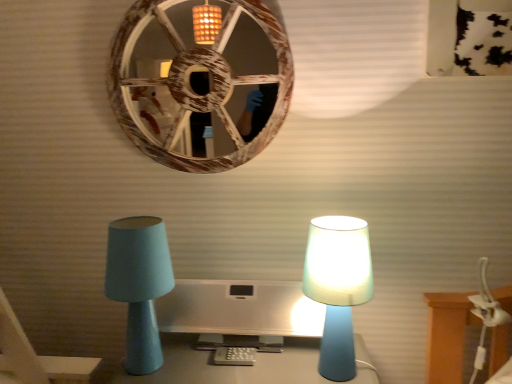
Question: Can we say wooden wheel at upper center lies outside matte blue lamp at left, the first lamp from the left?

Choices:
 (A) no
 (B) yes

Answer: (B)

Question: Can you confirm if wooden wheel at upper center is smaller than matte blue lamp at left, the first lamp from the left?

Choices:
 (A) yes
 (B) no

Answer: (B)

Question: Is wooden wheel at upper center to the right of matte blue lamp at left, the first lamp from the left, from the viewer's perspective?

Choices:
 (A) no
 (B) yes

Answer: (B)

Question: Is wooden wheel at upper center positioned with its back to matte blue lamp at left, which is counted as the second lamp, starting from the right?

Choices:
 (A) yes
 (B) no

Answer: (B)

Question: Is wooden wheel at upper center in contact with matte blue lamp at left, which is counted as the second lamp, starting from the right?

Choices:
 (A) no
 (B) yes

Answer: (A)

Question: From a real-world perspective, is satin silver monitor at center physically located above or below matte blue lamp at left, which is counted as the second lamp, starting from the right?

Choices:
 (A) above
 (B) below

Answer: (B)

Question: Relative to matte blue lamp at left, the first lamp from the left, is satin silver monitor at center in front or behind?

Choices:
 (A) front
 (B) behind

Answer: (B)

Question: Looking at their shapes, would you say satin silver monitor at center is wider or thinner than matte blue lamp at left, which is counted as the second lamp, starting from the right?

Choices:
 (A) wide
 (B) thin

Answer: (A)

Question: In terms of height, does satin silver monitor at center look taller or shorter compared to matte blue lamp at left, the first lamp from the left?

Choices:
 (A) tall
 (B) short

Answer: (B)

Question: From a real-world perspective, is matte blue lamp at left, the first lamp from the left, positioned above or below wooden wheel at upper center?

Choices:
 (A) above
 (B) below

Answer: (B)

Question: Does point (157, 225) appear closer or farther from the camera than point (196, 152)?

Choices:
 (A) farther
 (B) closer

Answer: (B)

Question: Is matte blue lamp at left, which is counted as the second lamp, starting from the right, wider or thinner than wooden wheel at upper center?

Choices:
 (A) wide
 (B) thin

Answer: (A)

Question: Visually, is matte blue lamp at left, which is counted as the second lamp, starting from the right, positioned to the left or to the right of wooden wheel at upper center?

Choices:
 (A) right
 (B) left

Answer: (B)

Question: In the image, is matte blue lamp at left, the first lamp from the left, on the left side or the right side of matte blue lamp at right, the 1th lamp from the right?

Choices:
 (A) left
 (B) right

Answer: (A)

Question: Considering the positions of matte blue lamp at left, the first lamp from the left, and matte blue lamp at right, the second lamp when ordered from left to right, in the image, is matte blue lamp at left, the first lamp from the left, bigger or smaller than matte blue lamp at right, the second lamp when ordered from left to right,?

Choices:
 (A) small
 (B) big

Answer: (B)